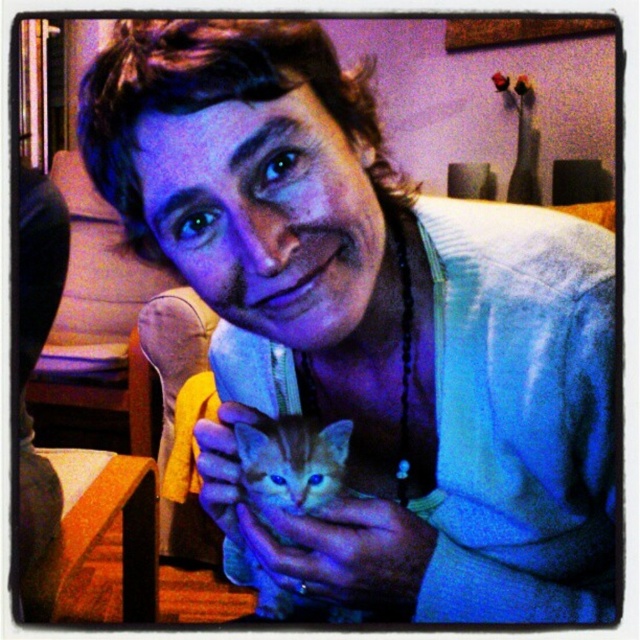
Which is above, matte skin hand at lower center or fuzzy orange cat at center?

Positioned higher is matte skin hand at lower center.

Is matte skin hand at lower center thinner than fuzzy orange cat at center?

No, matte skin hand at lower center is not thinner than fuzzy orange cat at center.

Which is behind, point (323, 513) or point (266, 460)?

The point (266, 460) is behind.

At what (x,y) coordinates should I click in order to perform the action: click on matte skin hand at lower center. Please return your answer as a coordinate pair (x, y). Image resolution: width=640 pixels, height=640 pixels. Looking at the image, I should click on (344, 552).